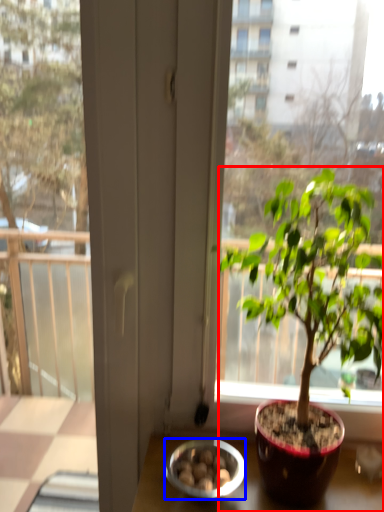
Question: Which object appears farthest to the camera in this image, houseplant (highlighted by a red box) or bowl (highlighted by a blue box)?

Choices:
 (A) houseplant
 (B) bowl

Answer: (B)